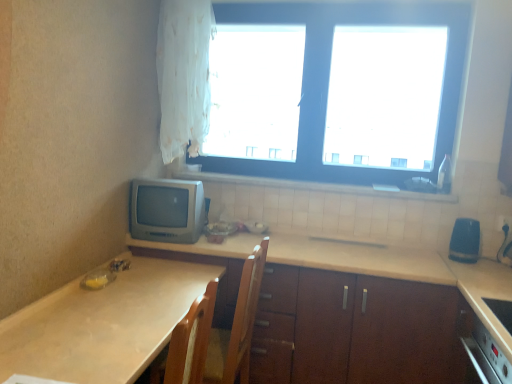
Question: Is beige laminate countertop at lower left, positioned as the 2th countertop in right-to-left order, positioned behind white sheer curtain at upper left?

Choices:
 (A) no
 (B) yes

Answer: (A)

Question: Considering the relative sizes of beige laminate countertop at lower left, positioned as the 2th countertop in right-to-left order, and white sheer curtain at upper left in the image provided, is beige laminate countertop at lower left, positioned as the 2th countertop in right-to-left order, bigger than white sheer curtain at upper left?

Choices:
 (A) yes
 (B) no

Answer: (A)

Question: Is beige laminate countertop at lower left, the first countertop viewed from the left, wider than white sheer curtain at upper left?

Choices:
 (A) no
 (B) yes

Answer: (B)

Question: Are beige laminate countertop at lower left, the first countertop viewed from the left, and white sheer curtain at upper left far apart?

Choices:
 (A) no
 (B) yes

Answer: (B)

Question: From the image's perspective, is beige laminate countertop at lower left, positioned as the 2th countertop in right-to-left order, on top of white sheer curtain at upper left?

Choices:
 (A) yes
 (B) no

Answer: (B)

Question: Looking at the image, does matte gray crt monitor at left, the 1th appliance from the left, seem bigger or smaller compared to white sheer curtain at upper left?

Choices:
 (A) small
 (B) big

Answer: (A)

Question: Is point (168, 226) positioned closer to the camera than point (192, 56)?

Choices:
 (A) closer
 (B) farther

Answer: (A)

Question: Is matte gray crt monitor at left, the second appliance viewed from the right, inside the boundaries of white sheer curtain at upper left, or outside?

Choices:
 (A) outside
 (B) inside

Answer: (A)

Question: From their relative heights in the image, would you say matte gray crt monitor at left, the second appliance viewed from the right, is taller or shorter than white sheer curtain at upper left?

Choices:
 (A) short
 (B) tall

Answer: (A)

Question: Would you say white tile at upper center is inside or outside white plastic electric outlet at lower right?

Choices:
 (A) inside
 (B) outside

Answer: (B)

Question: Considering their positions, is white tile at upper center located in front of or behind white plastic electric outlet at lower right?

Choices:
 (A) behind
 (B) front

Answer: (A)

Question: Considering the positions of white tile at upper center and white plastic electric outlet at lower right in the image, is white tile at upper center wider or thinner than white plastic electric outlet at lower right?

Choices:
 (A) thin
 (B) wide

Answer: (B)

Question: Is white tile at upper center to the left or to the right of white plastic electric outlet at lower right in the image?

Choices:
 (A) right
 (B) left

Answer: (B)

Question: Looking at their shapes, would you say white plastic electric outlet at lower right is wider or thinner than beige laminate countertop at center, which appears as the 1th countertop when viewed from the right?

Choices:
 (A) thin
 (B) wide

Answer: (A)

Question: Would you say white plastic electric outlet at lower right is to the left or to the right of beige laminate countertop at center, which appears as the 1th countertop when viewed from the right, in the picture?

Choices:
 (A) left
 (B) right

Answer: (B)